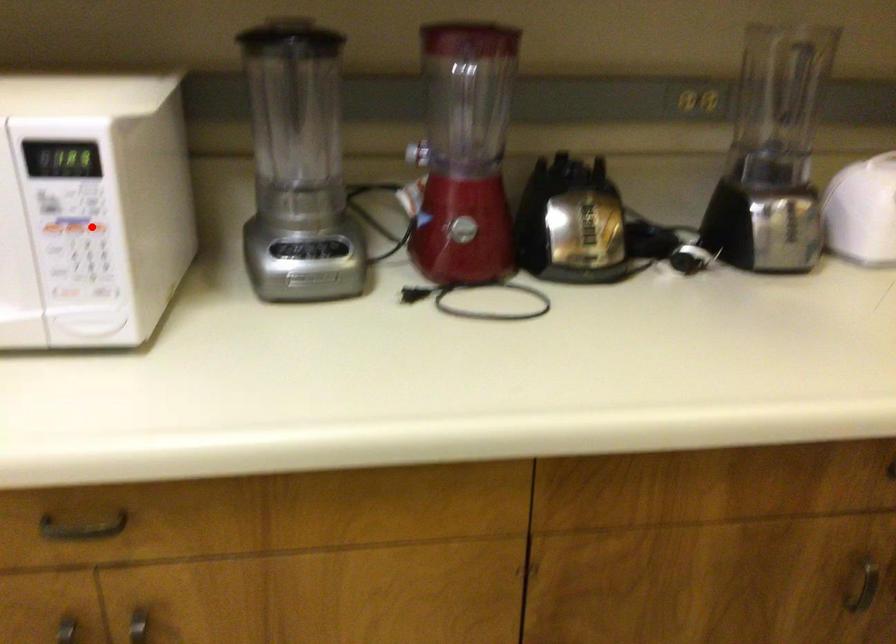
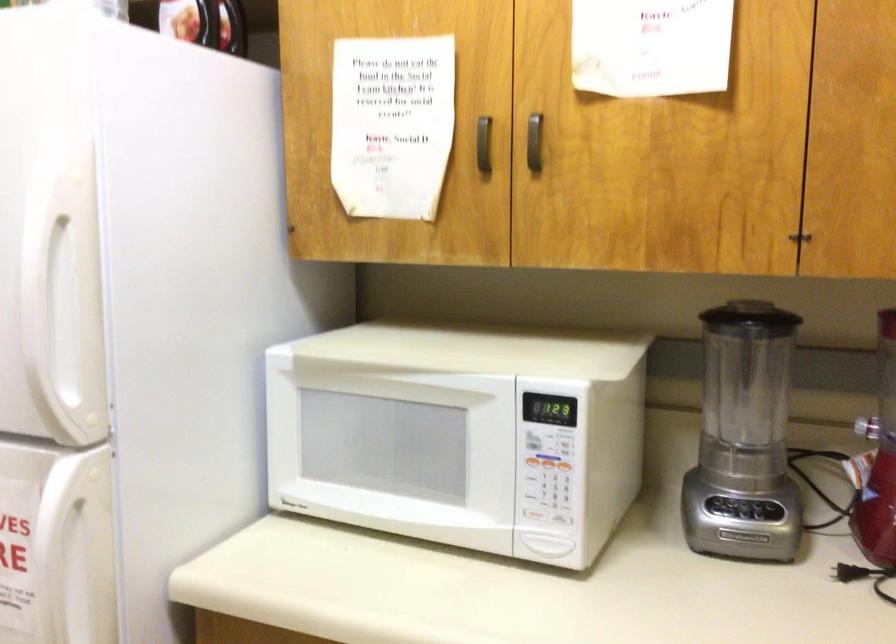
Question: A red point is marked in image1. In image2, is the corresponding 3D point closer to the camera or farther? Reply with the corresponding letter.

Choices:
 (A) The corresponding 3D point is closer.
 (B) The corresponding 3D point is farther.

Answer: (B)